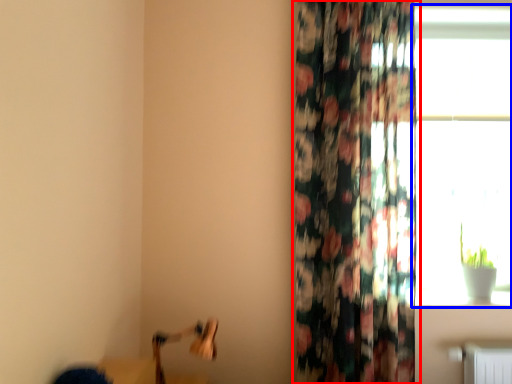
Question: Which point is closer to the camera, curtain (highlighted by a red box) or window (highlighted by a blue box)?

Choices:
 (A) curtain
 (B) window

Answer: (A)